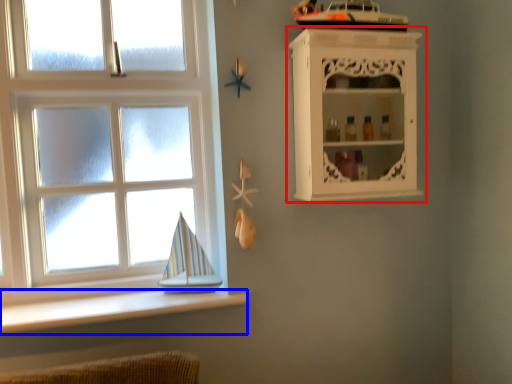
Question: Among these objects, which one is nearest to the camera, shelf (highlighted by a red box) or ledge (highlighted by a blue box)?

Choices:
 (A) shelf
 (B) ledge

Answer: (B)